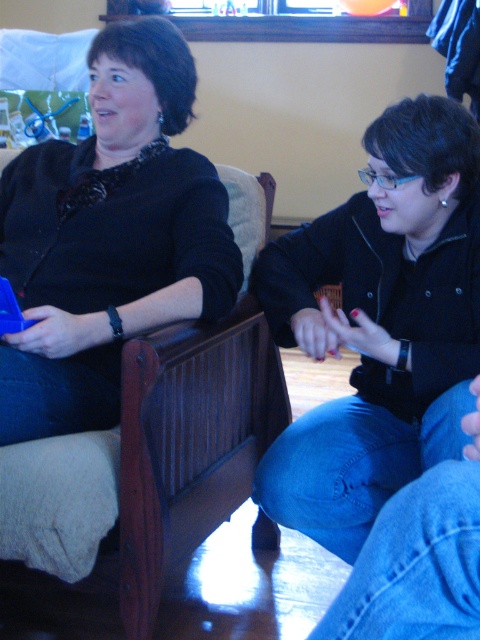
You are a photographer positioned in front of the two people. You want to take a photo that includes both the black matte sweater at upper left and the brown wood armchair at left. Which object should you focus on first to ensure both are in focus?

You should focus on the black matte sweater at upper left first because it is closer to you than the brown wood armchair at left, so focusing on the closer object ensures both will be in focus.

You are a tailor who needs to determine which garment requires more fabric to make between the black matte jacket at lower right and the black matte sweater at upper left. Based on the description, which one would need more fabric?

The black matte sweater at upper left requires more fabric to make because it is thicker than the black matte jacket at lower right.

You are designing a seating arrangement for a small living room and need to place both the black matte jacket at lower right and the brown wood armchair at left. Given their sizes, which object should be placed closer to the wall to save space?

The black matte jacket at lower right has a smaller width than the brown wood armchair at left, so placing the black matte jacket at lower right closer to the wall would save space since it takes up less room.